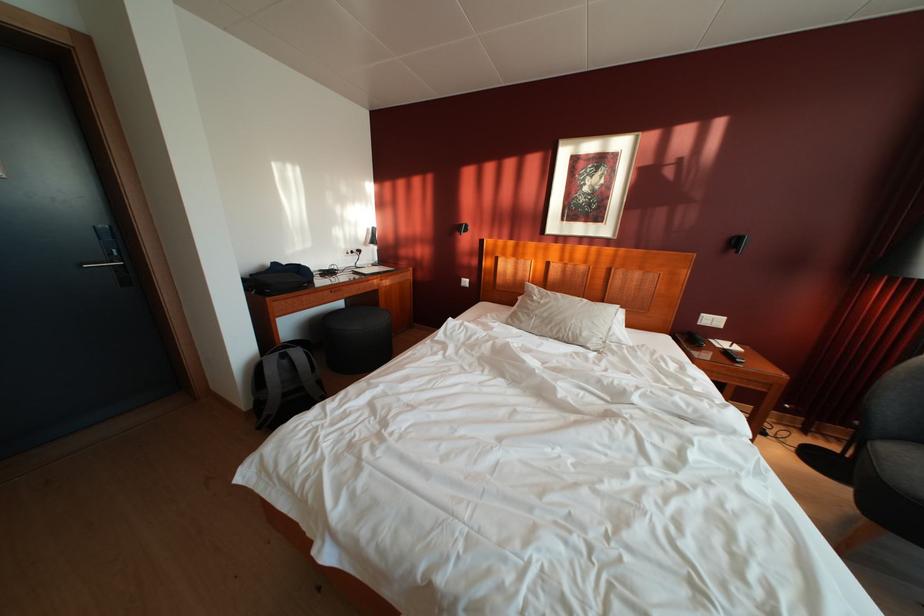
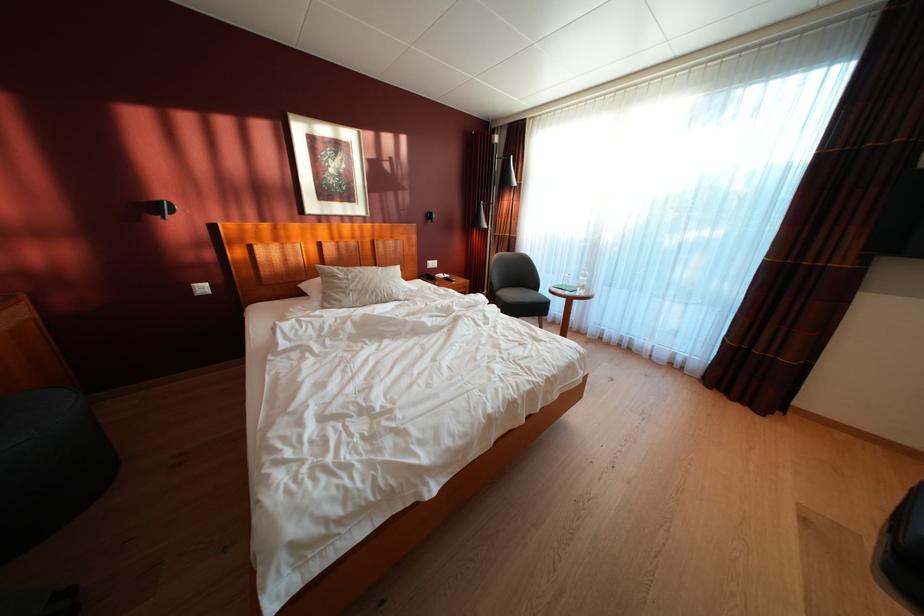
Question: The camera is either moving clockwise (left) or counter-clockwise (right) around the object. The first image is from the beginning of the video and the second image is from the end. Is the camera moving left or right when shooting the video?

Choices:
 (A) Left
 (B) Right

Answer: (A)